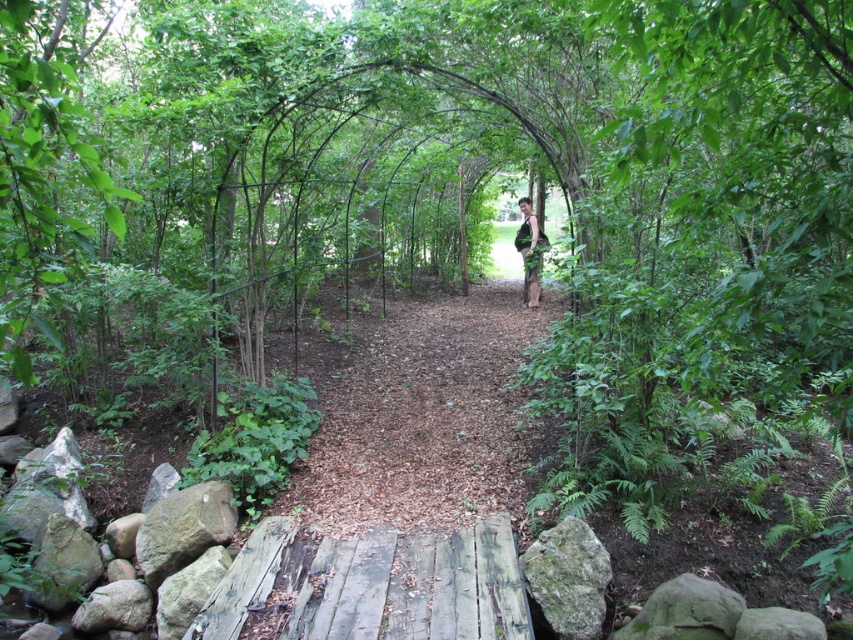
Consider the image. You are standing at the entrance of the wooden pathway and want to place a small potted plant exactly where the wooden planks at center are located. According to the coordinates provided, where should you place the potted plant?

You should place the potted plant at the coordinates point (399, 492) where the wooden planks at center are located.

You are a maintenance worker needing to inspect the wooden planks at center and the weathered wooden bridge at lower center. If your ladder is 33 inches long, can you safely place it between them to reach both areas?

The distance between the wooden planks at center and the weathered wooden bridge at lower center is 33.52 inches. Since the ladder is 33 inches long, it is slightly shorter than the required distance. Therefore, the ladder may not reach both areas safely.

You are standing at the entrance of the wooden pathway in the serene natural setting. You notice a point marked at coordinates (369, 586). What object is located at this point?

The point at coordinates (369, 586) corresponds to the weathered wooden bridge at lower center.